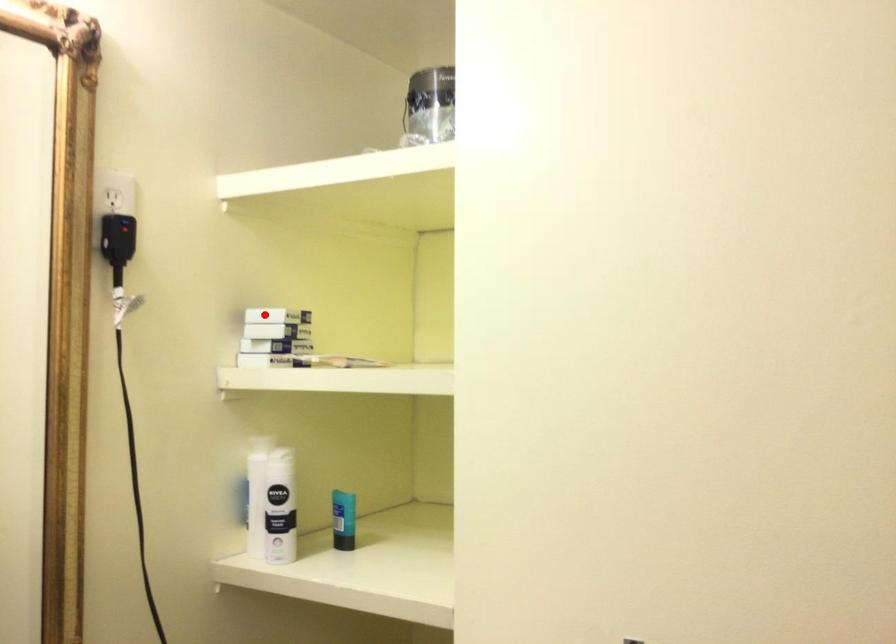
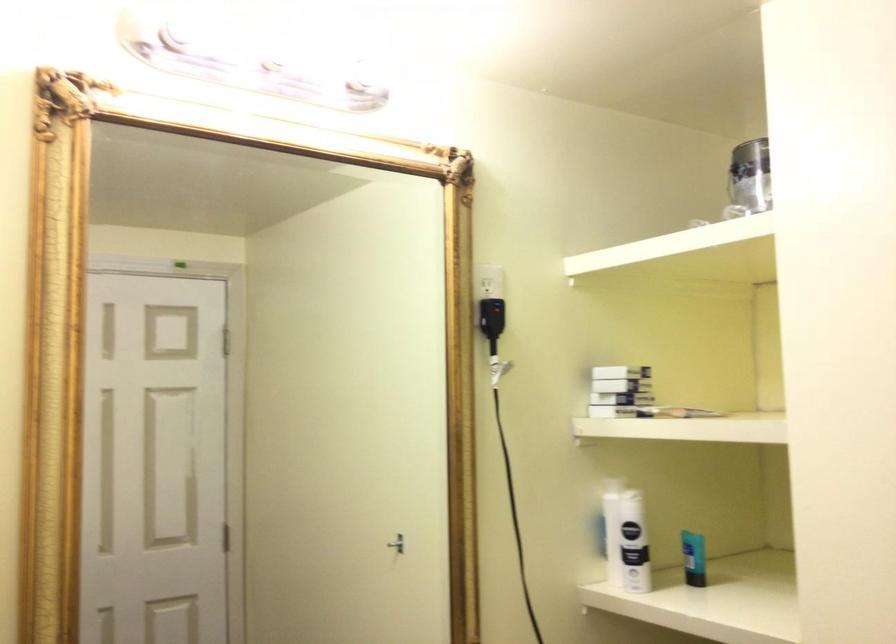
Find the pixel in the second image that matches the highlighted location in the first image.

(619, 373)